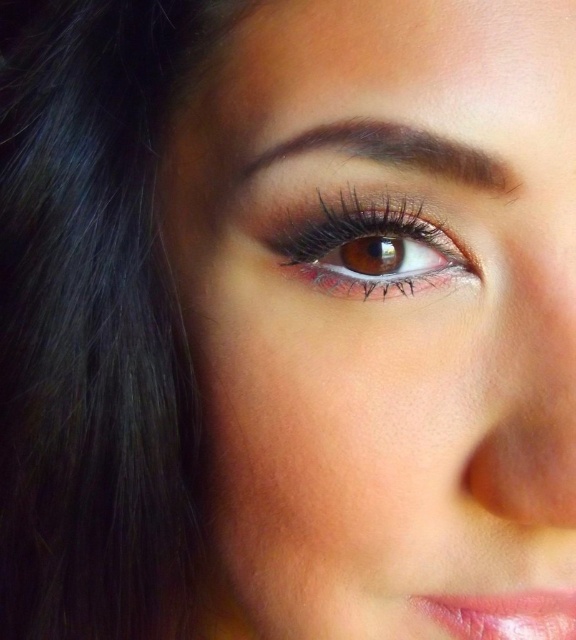
Measure the distance between brown matte eye at center and shiny pink lipstick at lower right.

brown matte eye at center and shiny pink lipstick at lower right are 6.25 inches apart from each other.

Can you confirm if brown matte eye at center is positioned to the right of shiny pink lipstick at lower right?

Incorrect, brown matte eye at center is not on the right side of shiny pink lipstick at lower right.

Locate an element on the screen. Image resolution: width=576 pixels, height=640 pixels. brown matte eye at center is located at coordinates (365, 243).

Image resolution: width=576 pixels, height=640 pixels. In order to click on brown matte eye at center in this screenshot , I will do tap(365, 243).

Consider the image. Which is more to the right, brown matte eye at center or dark brown matte eyebrow at upper center?

brown matte eye at center is more to the right.

Between point (450, 252) and point (467, 160), which one is positioned in front?

Point (467, 160)

Where is `brown matte eye at center`? This screenshot has height=640, width=576. brown matte eye at center is located at coordinates (365, 243).

Is matte brown eye at center shorter than shiny pink lipstick at lower right?

Incorrect, matte brown eye at center's height does not fall short of shiny pink lipstick at lower right's.

Does matte brown eye at center have a smaller size compared to shiny pink lipstick at lower right?

Actually, matte brown eye at center might be larger than shiny pink lipstick at lower right.

The image size is (576, 640). In order to click on matte brown eye at center in this screenshot , I will do `click(380, 307)`.